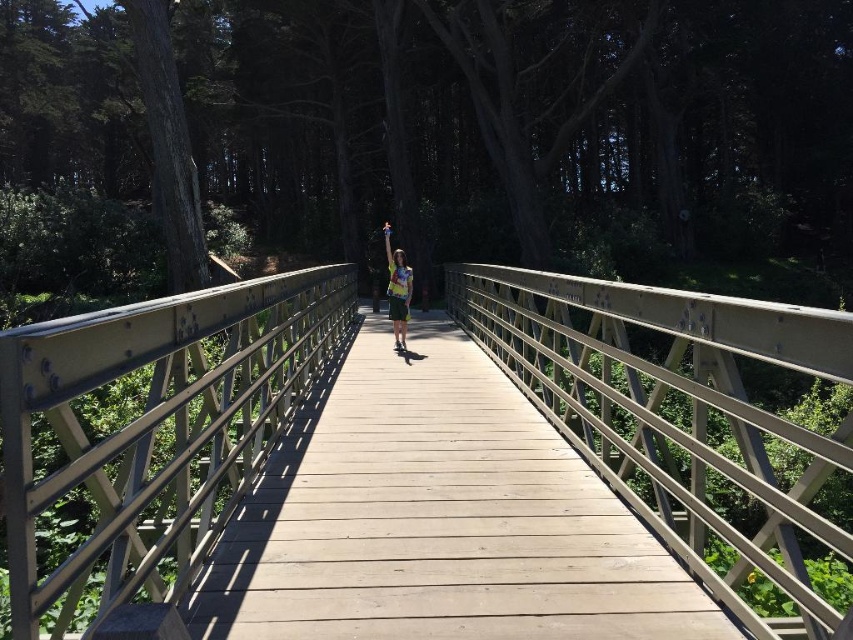
Question: Which point is closer to the camera taking this photo?

Choices:
 (A) (392, 326)
 (B) (647, 586)

Answer: (B)

Question: Based on their relative distances, which object is farther from the printed cotton shirt at center?

Choices:
 (A) wooden bridge at center
 (B) metallic silver rail at left

Answer: (A)

Question: Which point is closer to the camera taking this photo?

Choices:
 (A) (107, 449)
 (B) (425, 412)

Answer: (A)

Question: Can you confirm if metallic silver rail at left is thinner than printed cotton shirt at center?

Choices:
 (A) yes
 (B) no

Answer: (A)

Question: Is wooden bridge at center smaller than metallic silver rail at left?

Choices:
 (A) yes
 (B) no

Answer: (B)

Question: Can you confirm if wooden bridge at center is wider than metallic silver rail at left?

Choices:
 (A) yes
 (B) no

Answer: (A)